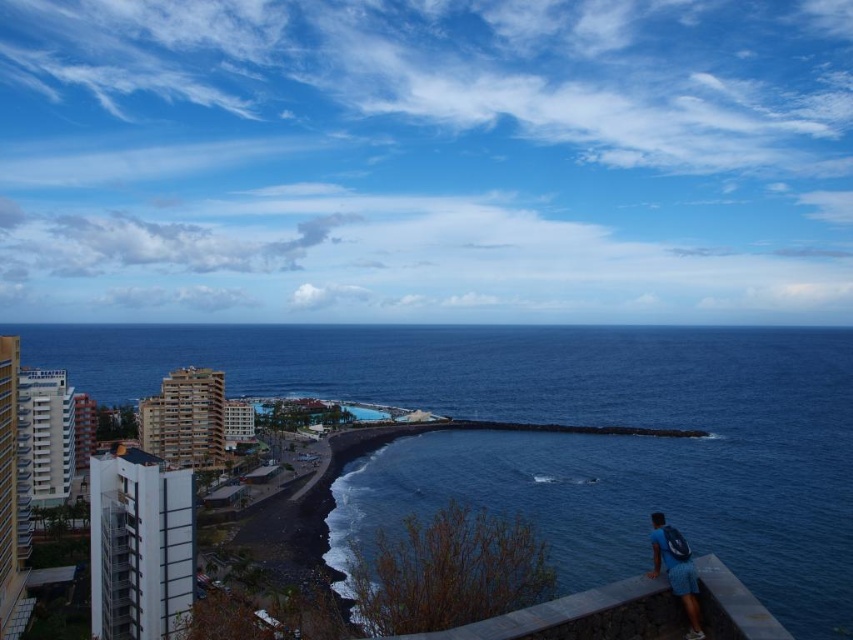
Consider the image. You are standing on the gray concrete ledge at lower right and want to reach the blue water at center. Which direction should you move to get there?

You should move to the left side to reach the blue water at center since it is positioned on the left side of the gray concrete ledge at lower right.

Based on the photo, you are standing on the gray concrete ledge at lower right and want to look at the blue water at center. Which direction should you move to see it better?

Since the gray concrete ledge at lower right is behind the blue water at center, you should move forward towards the blue water at center to have a clearer view.